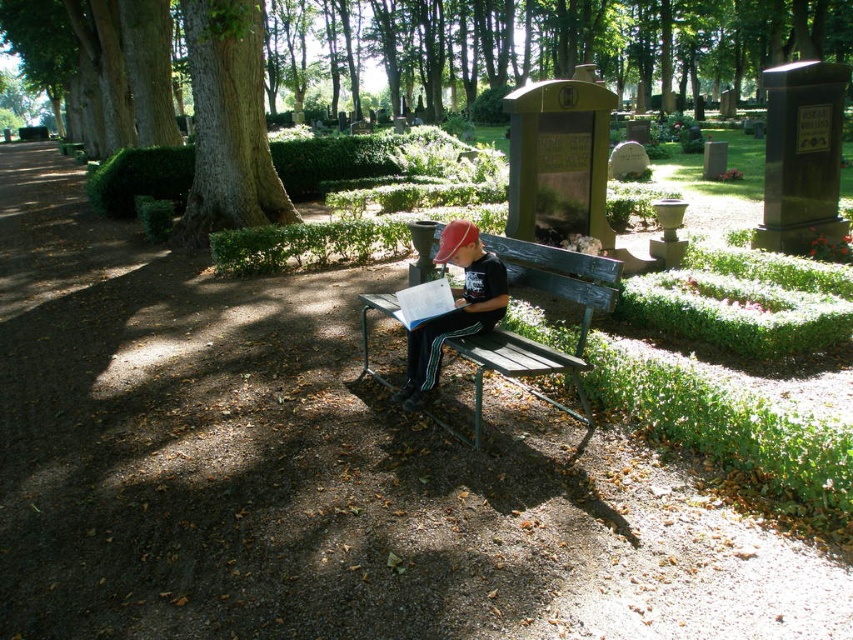
Who is positioned more to the right, green leafy tree at center or wooden bench at center?

Positioned to the right is wooden bench at center.

Can you confirm if green leafy tree at center is positioned above wooden bench at center?

Yes, green leafy tree at center is above wooden bench at center.

Is point (608, 60) behind point (479, 417)?

Yes, point (608, 60) is farther from viewer.

I want to click on green leafy tree at center, so click(x=606, y=40).

Can you confirm if green textured tree at upper left is bigger than wooden bench at center?

Indeed, green textured tree at upper left has a larger size compared to wooden bench at center.

Does green textured tree at upper left appear under wooden bench at center?

Actually, green textured tree at upper left is above wooden bench at center.

The width and height of the screenshot is (853, 640). In order to click on green textured tree at upper left in this screenshot , I will do `click(228, 122)`.

Which is more to the right, green leafy tree at center or green textured tree at upper left?

Positioned to the right is green leafy tree at center.

What do you see at coordinates (606, 40) in the screenshot?
I see `green leafy tree at center` at bounding box center [606, 40].

The height and width of the screenshot is (640, 853). Identify the location of green leafy tree at center. (606, 40).

The width and height of the screenshot is (853, 640). Identify the location of green leafy tree at center. (606, 40).